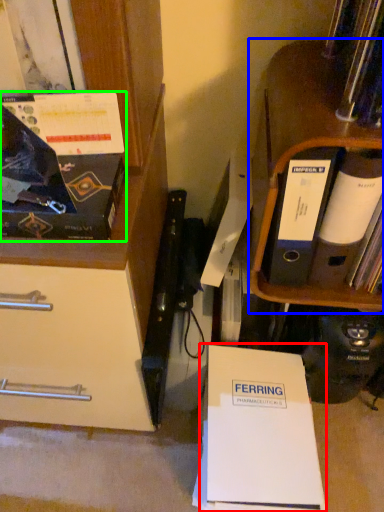
Question: Which object is positioned farthest from paperback book (highlighted by a red box)? Select from shelf (highlighted by a blue box) and magazine (highlighted by a green box).

Choices:
 (A) shelf
 (B) magazine

Answer: (B)